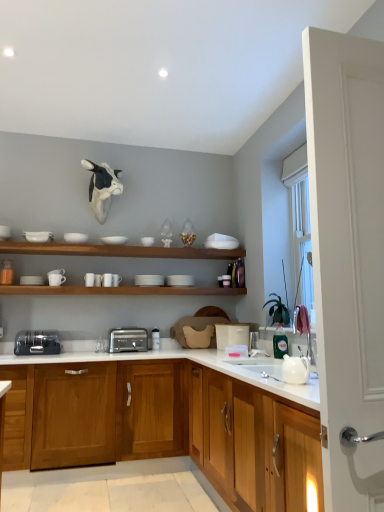
Question: Can you confirm if white glossy bowl at upper left, which is counted as the seventh tableware, starting from the right, is positioned to the right of wooden cabinet at center, the second cabinetry in the back-to-front sequence?

Choices:
 (A) yes
 (B) no

Answer: (B)

Question: Can you confirm if white glossy bowl at upper left, which is counted as the seventh tableware, starting from the right, is shorter than wooden cabinet at center, the 1th cabinetry from the front?

Choices:
 (A) no
 (B) yes

Answer: (B)

Question: Does white glossy bowl at upper left, which is counted as the seventh tableware, starting from the right, appear on the left side of wooden cabinet at center, the second cabinetry in the back-to-front sequence?

Choices:
 (A) yes
 (B) no

Answer: (A)

Question: Is white glossy bowl at upper left, placed as the second tableware when sorted from left to right, closer to camera compared to wooden cabinet at center, the second cabinetry in the back-to-front sequence?

Choices:
 (A) yes
 (B) no

Answer: (B)

Question: Does white glossy bowl at upper left, which is counted as the seventh tableware, starting from the right, lie behind wooden cabinet at center, the second cabinetry in the back-to-front sequence?

Choices:
 (A) no
 (B) yes

Answer: (B)

Question: Is white glossy bowl at upper left, placed as the second tableware when sorted from left to right, far away from wooden cabinet at center, the 1th cabinetry from the front?

Choices:
 (A) no
 (B) yes

Answer: (B)

Question: Is white matte bowl at upper center, the 4th tableware positioned from the left, positioned far away from white matte stack of plates at upper center, the 2th tableware from the right?

Choices:
 (A) yes
 (B) no

Answer: (B)

Question: Does white matte bowl at upper center, which ranks as the 5th tableware in right-to-left order, come behind white matte stack of plates at upper center, the 2th tableware from the right?

Choices:
 (A) no
 (B) yes

Answer: (A)

Question: Would you say white matte bowl at upper center, the 4th tableware positioned from the left, is outside white matte stack of plates at upper center, the 2th tableware from the right?

Choices:
 (A) yes
 (B) no

Answer: (A)

Question: Does white matte bowl at upper center, the 4th tableware positioned from the left, appear on the right side of white matte stack of plates at upper center, the 7th tableware in the left-to-right sequence?

Choices:
 (A) no
 (B) yes

Answer: (A)

Question: Is white matte bowl at upper center, which ranks as the 5th tableware in right-to-left order, smaller than white matte stack of plates at upper center, the 7th tableware in the left-to-right sequence?

Choices:
 (A) yes
 (B) no

Answer: (A)

Question: Is white matte bowl at upper center, the 4th tableware positioned from the left, looking in the opposite direction of white matte stack of plates at upper center, the 2th tableware from the right?

Choices:
 (A) no
 (B) yes

Answer: (A)

Question: Does white matte plate at center, the 8th tableware from the left, appear on the right side of white matte cup at left, the 8th tableware viewed from the right?

Choices:
 (A) yes
 (B) no

Answer: (A)